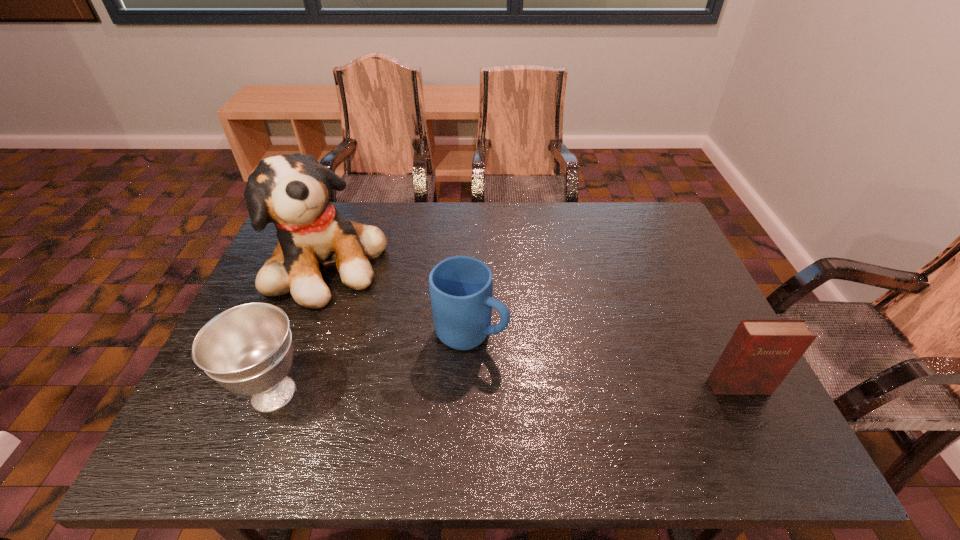
Where is `free space between the diary and the mug`? free space between the diary and the mug is located at coordinates (605, 360).

Locate an element on the screen. Image resolution: width=960 pixels, height=540 pixels. vacant space in between the rightmost object and the tallest object is located at coordinates (534, 326).

In order to click on free space between the tallest object and the chalice in this screenshot , I will do coord(301,329).

Identify the location of empty space between the third object from left to right and the chalice. The height and width of the screenshot is (540, 960). (372, 363).

Where is `vacant space that's between the rightmost object and the mug`? This screenshot has height=540, width=960. vacant space that's between the rightmost object and the mug is located at coordinates (605, 360).

Point out which object is positioned as the second nearest to the second object from right to left. Please provide its 2D coordinates. Your answer should be formatted as a tuple, i.e. [(x, y)], where the tuple contains the x and y coordinates of a point satisfying the conditions above.

[(247, 349)]

You are a GUI agent. You are given a task and a screenshot of the screen. Output one action in this format:
    pyautogui.click(x=<x>, y=<y>)
    Task: Click on the third closest object relative to the mug
    This screenshot has height=540, width=960.
    Given the screenshot: What is the action you would take?
    pyautogui.click(x=761, y=352)

What are the coordinates of `vacant region that satisfies the following two spatial constraints: 1. on the back side of the third object from left to right; 2. on the left side of the chalice` in the screenshot? It's located at (298, 333).

I want to click on vacant point that satisfies the following two spatial constraints: 1. on the front side of the tallest object; 2. on the left side of the second object from right to left, so click(x=304, y=333).